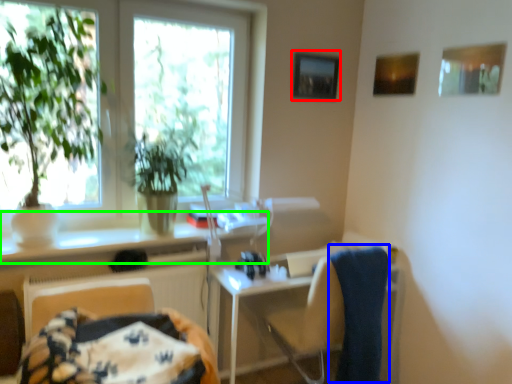
Question: Considering the real-world distances, which object is farthest from picture frame (highlighted by a red box)? bath towel (highlighted by a blue box) or counter top (highlighted by a green box)?

Choices:
 (A) bath towel
 (B) counter top

Answer: (A)